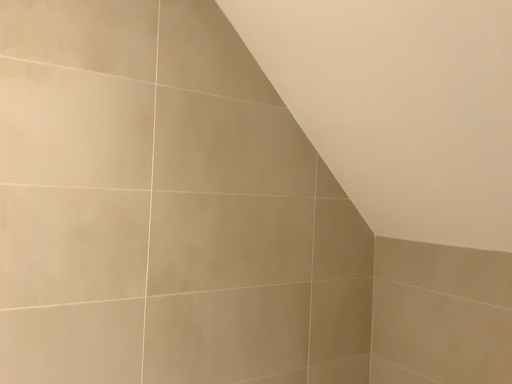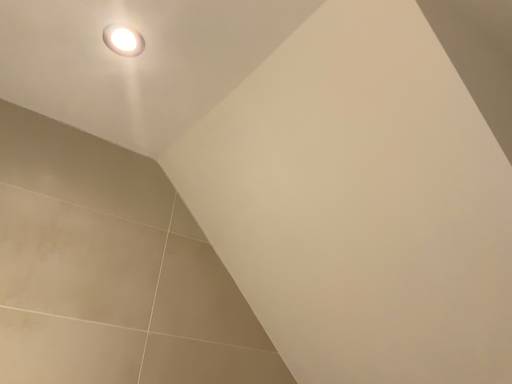
Question: Which way did the camera rotate in the video?

Choices:
 (A) rotated downward
 (B) rotated upward

Answer: (B)